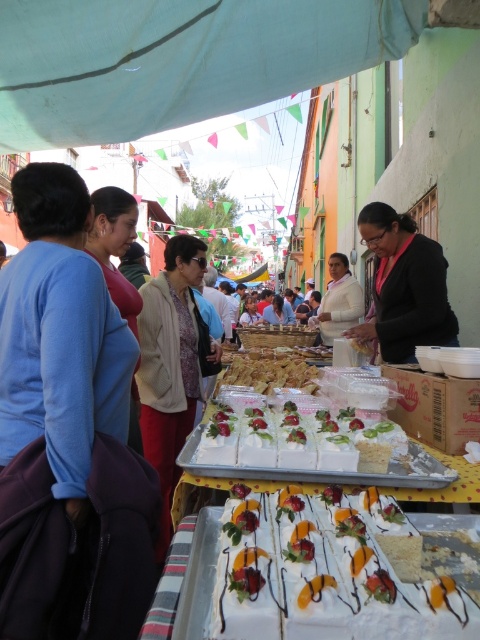
You are a customer at the market and want to take a photo of the golden crispy pastry at center without the white matte shirt at center blocking the view. Is the pastry visible from your current position?

The golden crispy pastry at center is in front of the white matte shirt at center, so yes, the pastry is visible and not blocked by the shirt.

What are the coordinates of the golden crispy pastry at center?

The golden crispy pastry at center is located at point (269, 372).